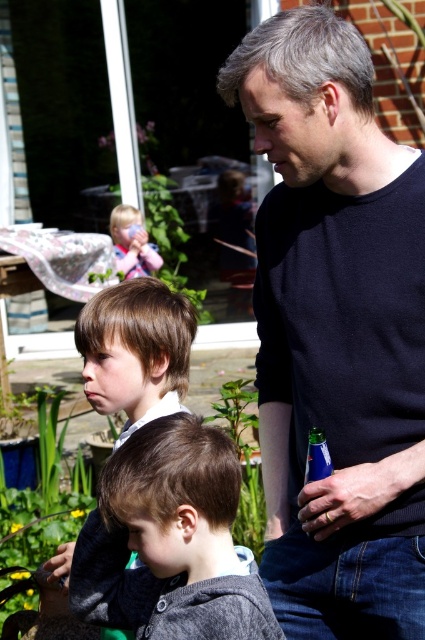
You are standing in the garden and see the dark blue sweater at center and the green leafy plant at upper left. Which object is positioned more to the east?

The dark blue sweater at center is to the right of the green leafy plant at upper left, so if the plant is at upper left, the sweater would be more to the east.

You are standing in a garden and see the dark gray sweater at lower center and the green leafy plant at upper left. Which object is closer to the ground?

The dark gray sweater at lower center is positioned under the green leafy plant at upper left, so it is closer to the ground.

You are standing in a garden and see the dark gray sweater at lower center and the green leafy plant at upper left. Which object is shorter?

The dark gray sweater at lower center is shorter than the green leafy plant at upper left.